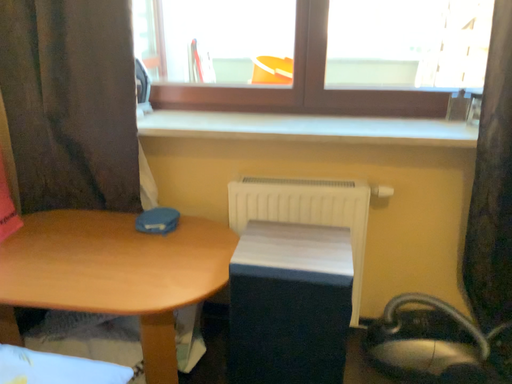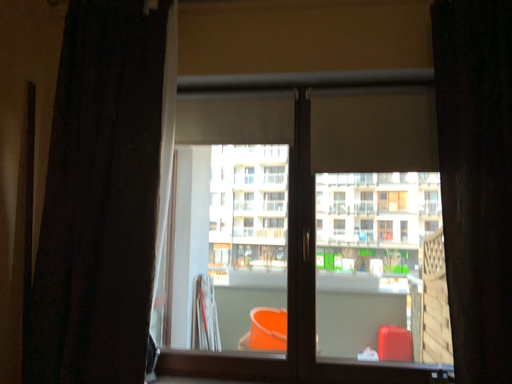
Question: Which way did the camera rotate in the video?

Choices:
 (A) rotated upward
 (B) rotated downward

Answer: (A)